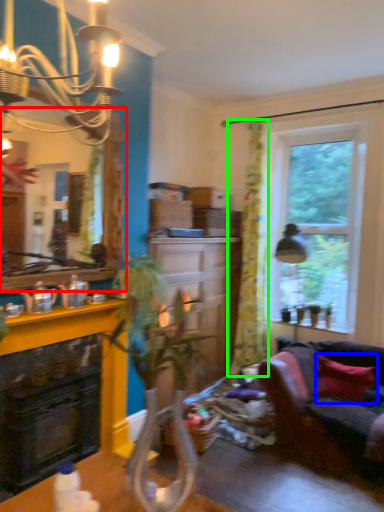
Question: Based on their relative distances, which object is nearer to mirror (highlighted by a red box)? Choose from pillow (highlighted by a blue box) and curtain (highlighted by a green box).

Choices:
 (A) pillow
 (B) curtain

Answer: (B)